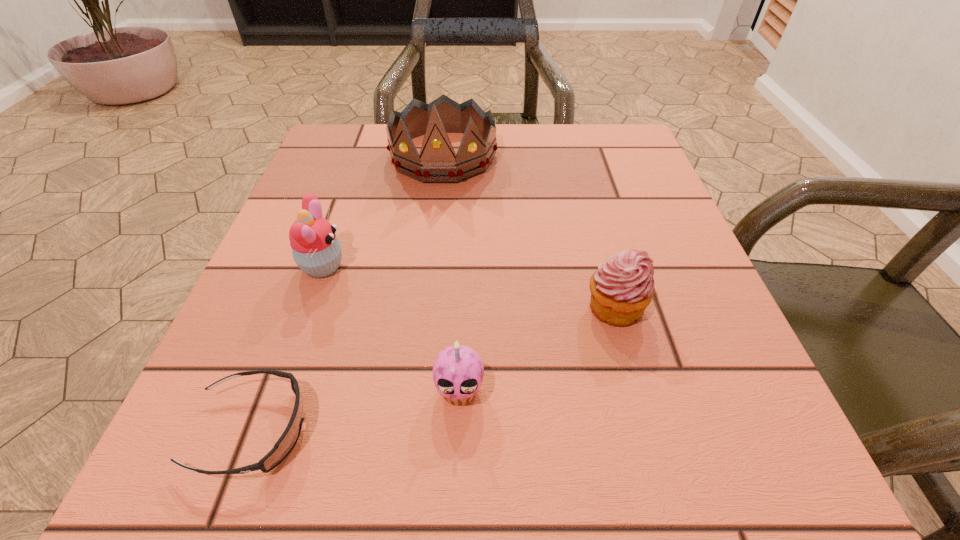
In the image, there is a desktop. Identify the location of vacant area at the left edge. The height and width of the screenshot is (540, 960). (286, 325).

Where is `vacant space at the right edge of the desktop`? vacant space at the right edge of the desktop is located at coordinates (726, 343).

Locate an element on the screen. Image resolution: width=960 pixels, height=540 pixels. free space at the near left corner of the desktop is located at coordinates (252, 483).

Where is `vacant region at the far right corner`? This screenshot has width=960, height=540. vacant region at the far right corner is located at coordinates (636, 174).

The width and height of the screenshot is (960, 540). Identify the location of free space at the near right corner. (707, 477).

You are a GUI agent. You are given a task and a screenshot of the screen. Output one action in this format:
    pyautogui.click(x=<x>, y=<y>)
    Task: Click on the vacant point located between the leftmost cupcake and the tiara
    Image resolution: width=960 pixels, height=540 pixels.
    Given the screenshot: What is the action you would take?
    pyautogui.click(x=383, y=211)

This screenshot has width=960, height=540. Identify the location of vacant space in between the nearest cupcake and the rightmost cupcake. (537, 349).

Where is `free spot between the rightmost object and the leftmost cupcake`? The image size is (960, 540). free spot between the rightmost object and the leftmost cupcake is located at coordinates (468, 287).

You are a GUI agent. You are given a task and a screenshot of the screen. Output one action in this format:
    pyautogui.click(x=<x>, y=<y>)
    Task: Click on the vacant point located between the shortest object and the farthest object
    
    Given the screenshot: What is the action you would take?
    pyautogui.click(x=348, y=293)

Identify the location of vacant region between the shortest object and the tiara. This screenshot has height=540, width=960. (348, 293).